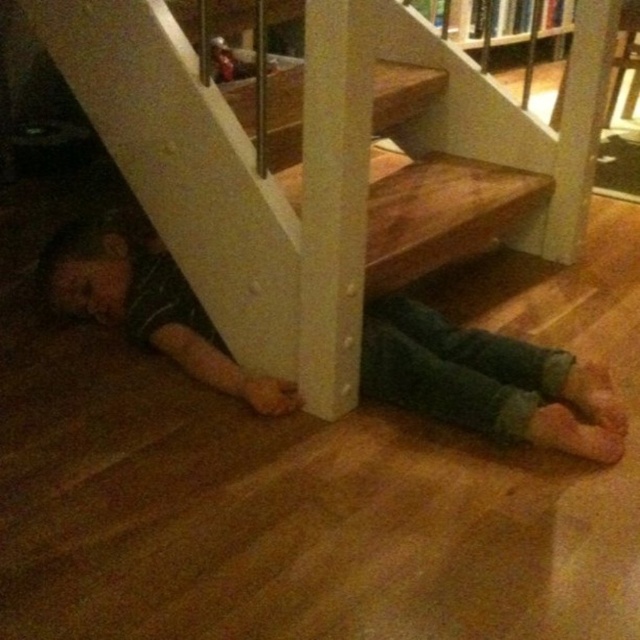
Question: Is wooden at lower left further to camera compared to green denim pants at lower left?

Choices:
 (A) no
 (B) yes

Answer: (A)

Question: Which point is farther to the camera?

Choices:
 (A) (561, 381)
 (B) (282, 248)

Answer: (A)

Question: Can you confirm if wooden at lower left is positioned below green denim pants at lower left?

Choices:
 (A) yes
 (B) no

Answer: (B)

Question: Can you confirm if wooden at lower left is wider than green denim pants at lower left?

Choices:
 (A) yes
 (B) no

Answer: (A)

Question: Which object appears closest to the camera in this image?

Choices:
 (A) wooden at lower left
 (B) green denim pants at lower left

Answer: (A)